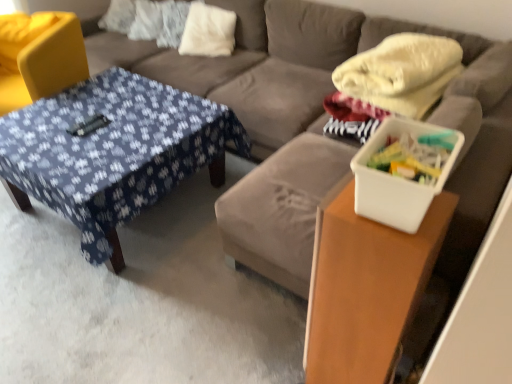
At what (x,y) coordinates should I click in order to perform the action: click on vacant area on top of blue fabric-covered table at center, which is the 2th table in front-to-back order (from a real-world perspective). Please return your answer as a coordinate pair (x, y). Looking at the image, I should click on (102, 122).